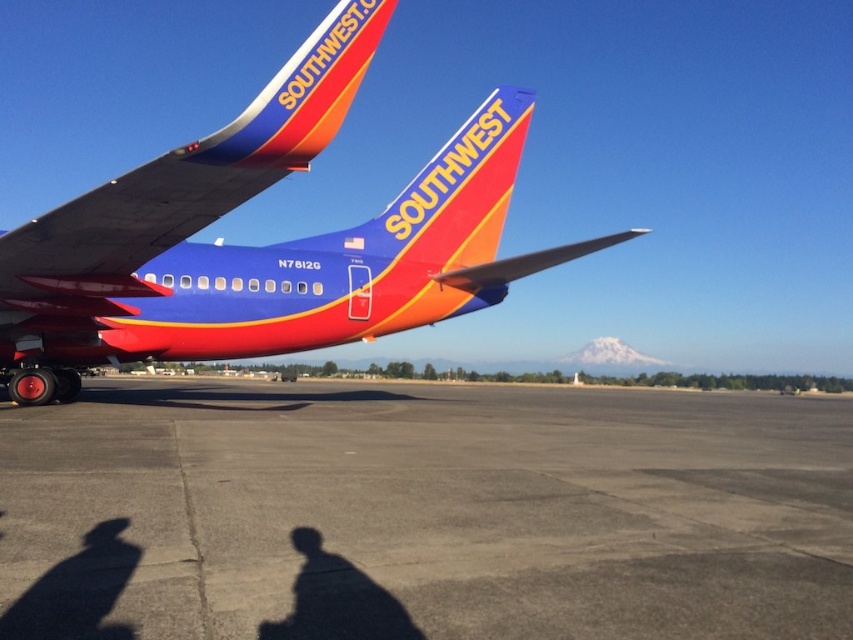
You are standing on the gray asphalt tarmac at center. A Southwest Airlines aircraft is parked here with its tail facing north. If you walk directly towards the tail of the aircraft, will you be moving north, south, east, or west?

Since the Southwest Airlines aircraft is parked with its tail facing north, walking directly towards the tail means you are moving north. However, the gray asphalt tarmac at center is located at point coordinates that might affect direction, but according to the given information, the tail direction determines the movement direction. Therefore, you would be moving north.

You are standing on the gray asphalt tarmac at center and want to take a photo of the matte blue airplane at center. Since the snowcapped mountain is in the background, will the airplane be in focus if you focus on the tarmac?

The gray asphalt tarmac at center is closer to the viewer than the matte blue airplane at center, so focusing on the tarmac would not keep the airplane in focus. You need to focus on the airplane itself.